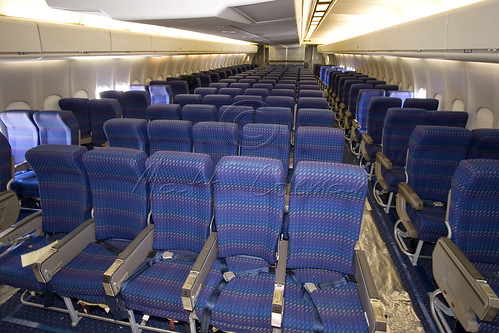
Where is `seat cushion`? The height and width of the screenshot is (333, 499). seat cushion is located at coordinates pyautogui.click(x=479, y=260), pyautogui.click(x=427, y=205), pyautogui.click(x=394, y=174), pyautogui.click(x=377, y=145), pyautogui.click(x=31, y=181), pyautogui.click(x=18, y=261), pyautogui.click(x=84, y=262), pyautogui.click(x=169, y=277), pyautogui.click(x=244, y=289), pyautogui.click(x=334, y=301).